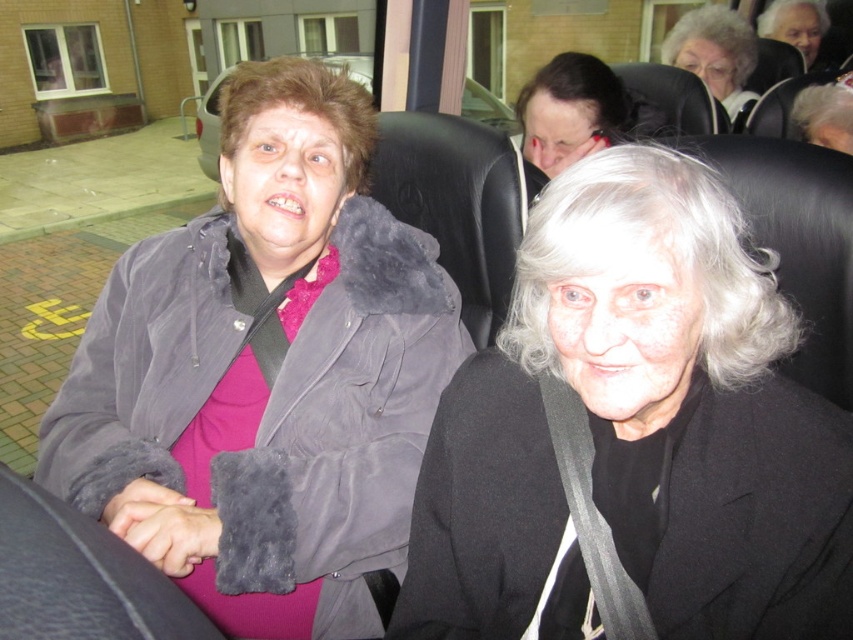
You are a passenger on a bus and need to reach your bag stored under the seat. You see a black woolen coat at center and a gray fuzzy jacket at upper left. Which item is closer to the floor?

The black woolen coat at center is positioned under gray fuzzy jacket at upper left, meaning it is closer to the floor than the gray fuzzy jacket at upper left.

You are a passenger on a bus and see two objects in the scene described. The first is the gray hair at upper right and the second is the gray fuzzy jacket at upper left. Which object is positioned closer to you?

The gray hair at upper right is closer to the viewer than the gray fuzzy jacket at upper left.